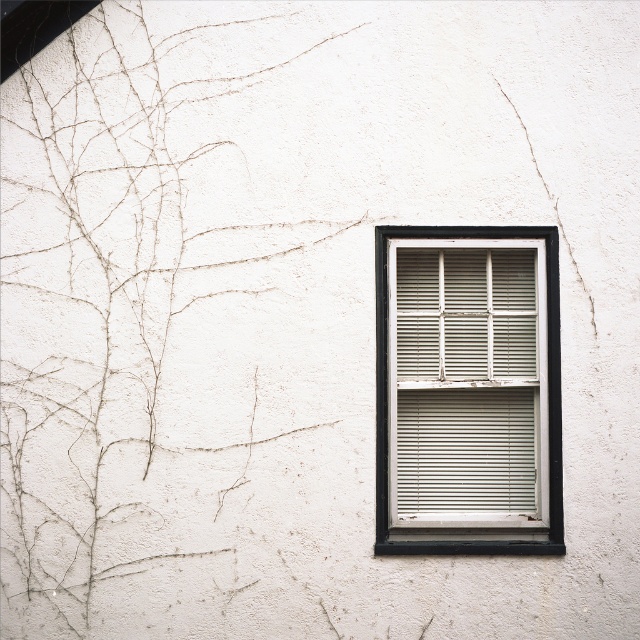
You are an artist planning to paint this building. You want to highlight the contrast between the brown textured ivy at upper left and the white painted wood window frame at center. Which object should you focus on more to emphasize their size difference?

The brown textured ivy at upper left has a larger size compared to the white painted wood window frame at center, so focusing on the brown textured ivy at upper left will emphasize their size difference.

You are standing in front of a building with a weathered white wall and a black window frame. There is a point marked at coordinates (140,312). What is located at that point?

The point at coordinates (140,312) indicates brown textured ivy at upper left.

You are standing in front of the building and notice the brown textured ivy at upper left and the white painted wood window frame at center. Which object is closer to the left side of the window frame?

The brown textured ivy at upper left is positioned on the left side of white painted wood window frame at center, so it is closer to the left side of the window frame.